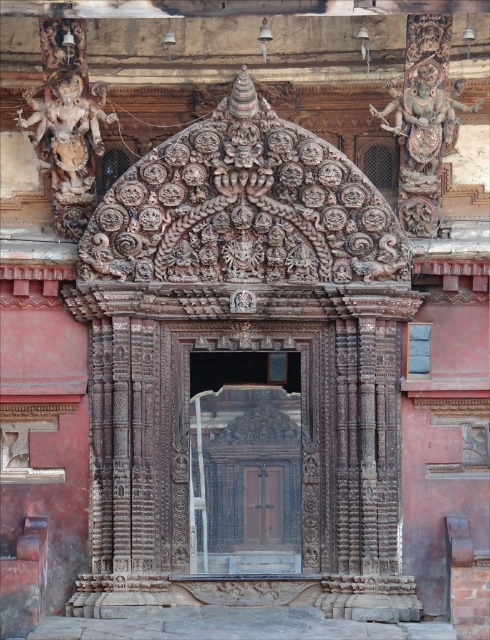
You are an architect examining the temple entrance. You notice the dark wood door at center and the carved wood deity at center. Which object is positioned higher up in the image?

The carved wood deity at center is positioned higher up because the dark wood door at center is located below it.

You are an architect examining the intricate carvings on the stone doorway. You notice two points marked on the image at coordinates point (435,93) and point (54,88). Which point is closer to your line of sight?

Point (435,93) is further to the viewer than point (54,88), so the point closer to your line of sight is point (54,88).

You are an architect designing a new temple and want to replicate the distance between the dark wood door at center and the carved stone statue at upper left in the image. What is the exact distance you should maintain between them?

The exact distance between the dark wood door at center and the carved stone statue at upper left should be 17.82 meters.